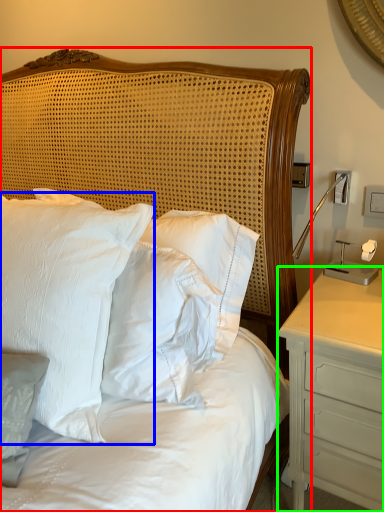
Question: Considering the real-world distances, which object is farthest from bed (highlighted by a red box)? pillow (highlighted by a blue box) or nightstand (highlighted by a green box)?

Choices:
 (A) pillow
 (B) nightstand

Answer: (B)